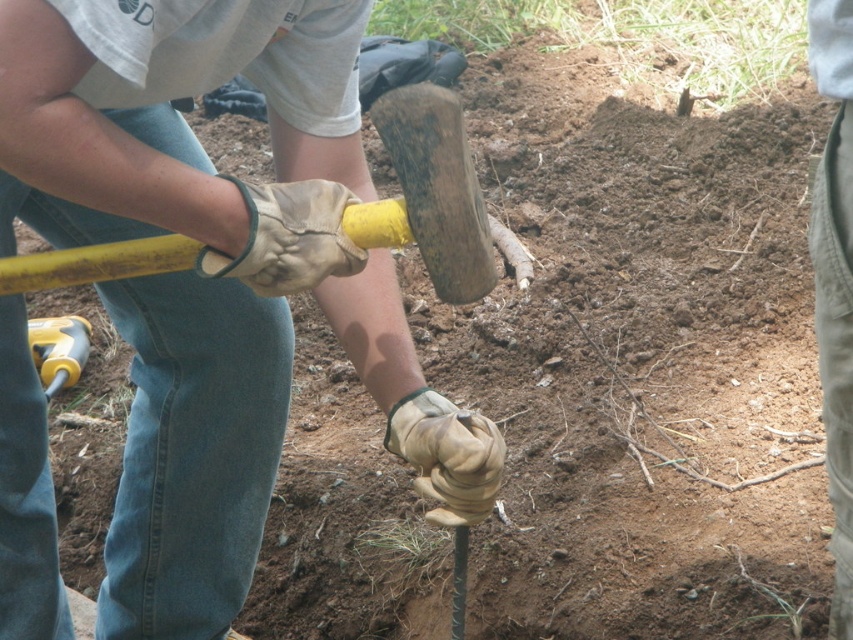
Who is taller, wooden hammer at center or yellow plastic handle at lower left?

wooden hammer at center is taller.

Is point (223, 266) farther from camera compared to point (48, 396)?

That is False.

Identify the location of wooden hammer at center. The height and width of the screenshot is (640, 853). (207, 268).